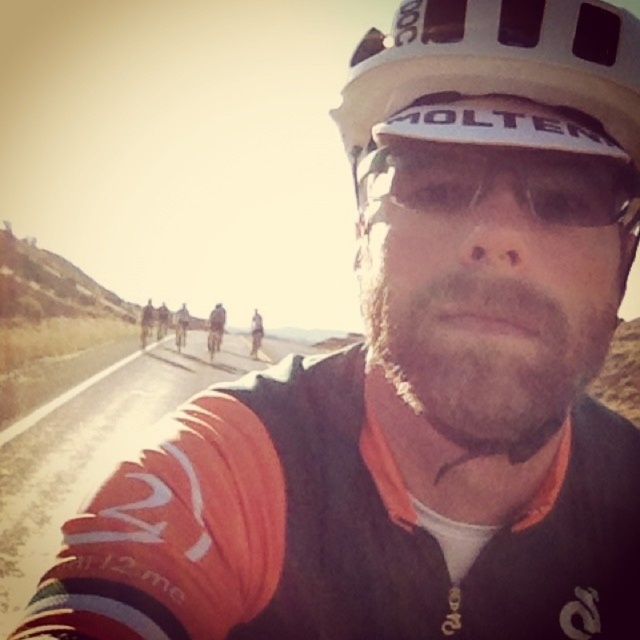
You are a photographer positioned at the origin of the coordinate system. You want to take a photo of the cyclist wearing the white matte helmet at center. The camera can only focus on objects within a radius of 0.1 units from a specified point. If you choose to focus at point [497,76], will the white matte helmet at center be in focus?

Yes, the point [497,76] indicates the white matte helmet at center, so focusing there will ensure it is in focus.